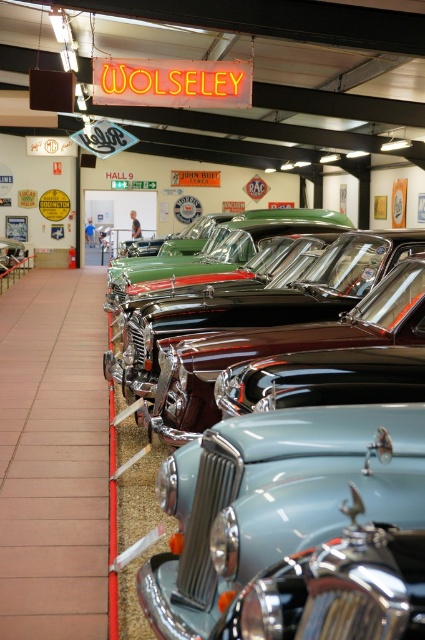
You are standing in the vintage car museum and want to take a photo of the satin teal car at center. Your camera has a minimum focus distance of 8 feet. Will you be able to focus on the car without moving closer?

The satin teal car at center is 7.32 feet away from viewer, which is within the camera minimum focus distance of 8 feet. Therefore, you can focus on the car without moving closer.

You are standing in the vintage car museum and want to take a photo of both point [387,488] and point [348,296]. Which point should you focus on first to ensure both are in focus?

Point [387,488] is closer to the camera than point [348,296]. To ensure both are in focus, focus on point [387,488] first because it is nearer, allowing the camera to adjust the depth of field to include the farther point as well.

You are a tour guide leading a group through the car museum. You want to ensure visitors can comfortably walk between the satin teal car at center and the light blue metallic car at center. The museum requires a minimum of 3 meters of space between exhibits for safety. Does the current spacing meet the requirement?

The satin teal car at center and light blue metallic car at center are 3.70 meters apart from each other, which exceeds the museum requirement of 3 meters. Therefore, the spacing meets the safety requirement.